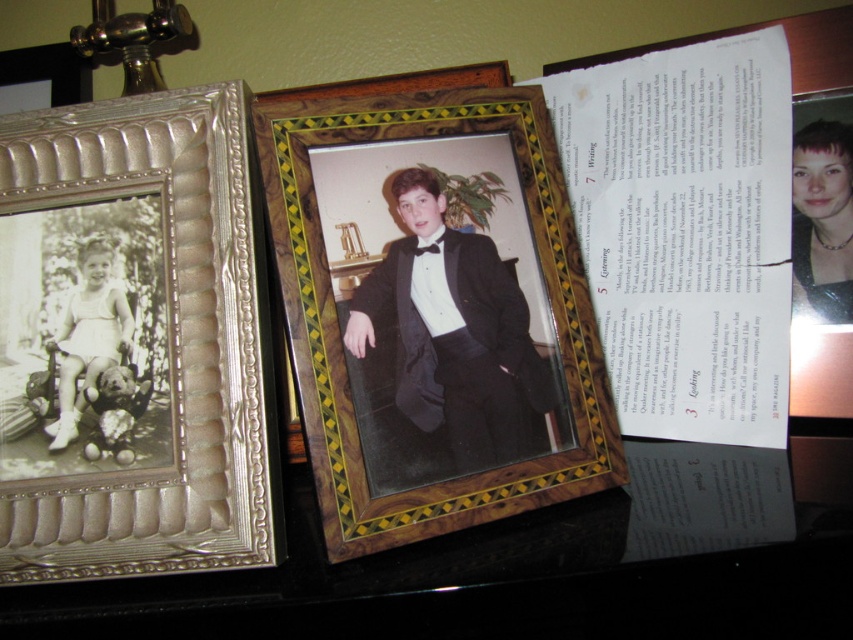
Question: Considering the real-world distances, which object is farthest from the matte black dress at upper right?

Choices:
 (A) silver textured frame at left
 (B) white matte dress at left
 (C) black satin tuxedo at center

Answer: (B)

Question: Does silver textured frame at left appear on the right side of black satin tuxedo at center?

Choices:
 (A) no
 (B) yes

Answer: (A)

Question: Is black glossy table at center thinner than white satin cocktail dress at left?

Choices:
 (A) no
 (B) yes

Answer: (A)

Question: Which object is farther from the camera taking this photo?

Choices:
 (A) white satin cocktail dress at left
 (B) wooden with inlaid patterns at center

Answer: (A)

Question: Which object is the farthest from the silver textured frame at left?

Choices:
 (A) silver metallic photo frame at upper left
 (B) black satin tuxedo at center
 (C) wooden with inlaid patterns at center

Answer: (A)

Question: Is silver textured frame at left thinner than white matte dress at left?

Choices:
 (A) yes
 (B) no

Answer: (B)